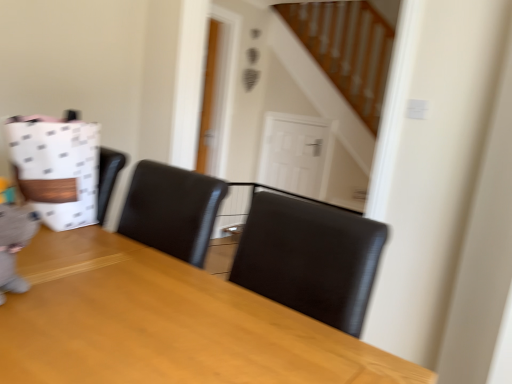
I want to click on empty space that is ontop of white glossy door at center, so click(x=296, y=125).